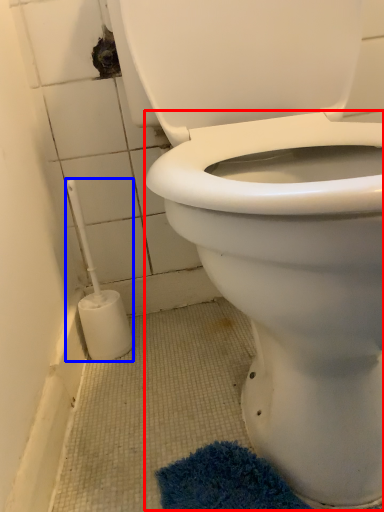
Question: Among these objects, which one is nearest to the camera, bidet (highlighted by a red box) or brush (highlighted by a blue box)?

Choices:
 (A) bidet
 (B) brush

Answer: (A)